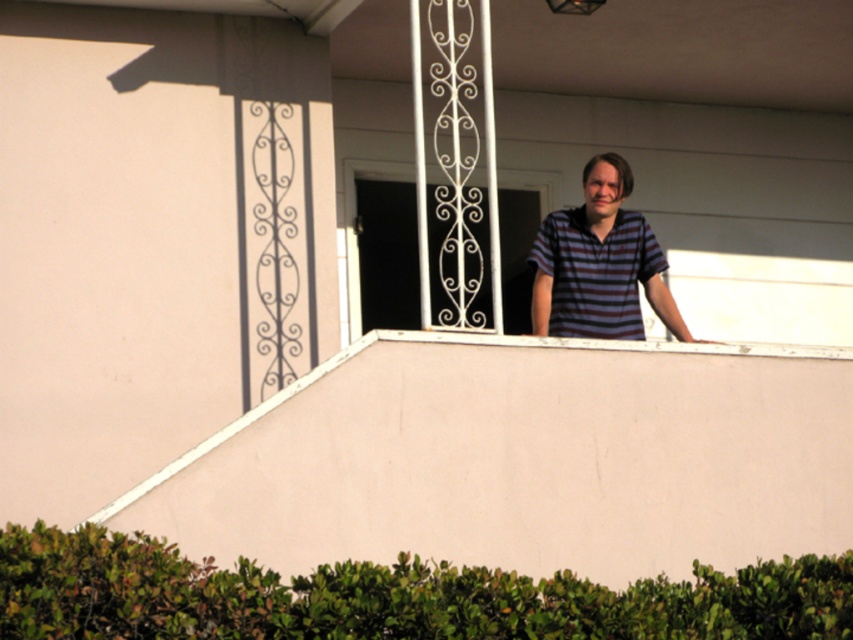
You are standing on the ground floor of the building and want to reach the pink matte balcony at upper center. If your maximum reach is 50 feet, can you touch it without any assistance?

The pink matte balcony at upper center is 55.42 feet away from viewer, so you cannot touch it without assistance since it exceeds your maximum reach of 50 feet.

You are standing at the center of the image. Where is the pink matte balcony at upper center located in relation to your position?

The pink matte balcony at upper center is located at point 0.717 on the x axis and 0.614 on the y axis relative to the center of the image.

You are a window cleaner standing on the balcony. You need to reach both the striped cotton shirt at upper center and the white wrought iron at upper center. Which object should you clean first if you want to start from the lower part of the balcony?

You should clean the striped cotton shirt at upper center first because it is located below the white wrought iron at upper center, making it the lower part of the balcony.